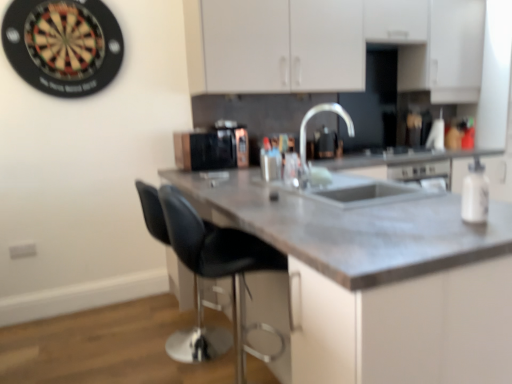
Locate an element on the screen. vacant space in black leather swivel chair at lower left (from a real-world perspective) is located at coordinates (177, 345).